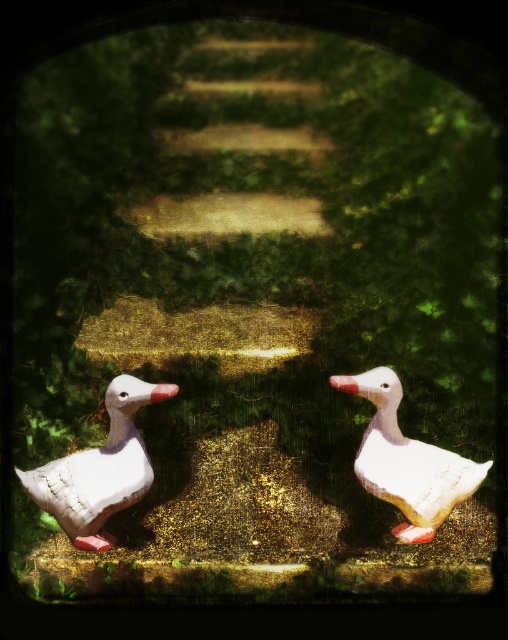
Does white matte duck at lower left come behind white matte duck at center?

No, white matte duck at lower left is in front of white matte duck at center.

Who is more forward, (67, 497) or (397, 404)?

Positioned in front is point (67, 497).

Find the location of a particular element. This screenshot has width=508, height=640. white matte duck at lower left is located at coordinates (100, 468).

You are a GUI agent. You are given a task and a screenshot of the screen. Output one action in this format:
    pyautogui.click(x=<x>, y=<y>)
    Task: Click on the white matte duck at lower left
    The height and width of the screenshot is (640, 508).
    Given the screenshot: What is the action you would take?
    pyautogui.click(x=100, y=468)